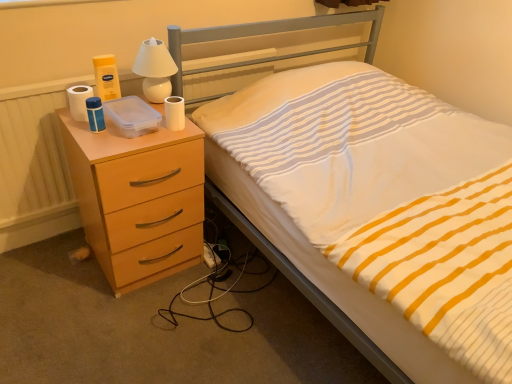
Question: Is the position of white matte toilet paper at upper right, the 1th toilet paper from the right, less distant than that of white glossy lamp at upper center?

Choices:
 (A) no
 (B) yes

Answer: (B)

Question: Can you confirm if white matte toilet paper at upper right, the 1th toilet paper from the right, is taller than white glossy lamp at upper center?

Choices:
 (A) yes
 (B) no

Answer: (B)

Question: Is white matte toilet paper at upper right, which is counted as the 2th toilet paper, starting from the left, shorter than white glossy lamp at upper center?

Choices:
 (A) yes
 (B) no

Answer: (A)

Question: From the image's perspective, is white matte toilet paper at upper right, which is counted as the 2th toilet paper, starting from the left, above white glossy lamp at upper center?

Choices:
 (A) no
 (B) yes

Answer: (A)

Question: Is white matte toilet paper at upper right, which is counted as the 2th toilet paper, starting from the left, bigger than white glossy lamp at upper center?

Choices:
 (A) yes
 (B) no

Answer: (B)

Question: In terms of width, does peach wood chest of drawers at left look wider or thinner when compared to white matte toilet paper at upper right, the 1th toilet paper from the right?

Choices:
 (A) thin
 (B) wide

Answer: (B)

Question: From a real-world perspective, is peach wood chest of drawers at left positioned above or below white matte toilet paper at upper right, the 1th toilet paper from the right?

Choices:
 (A) above
 (B) below

Answer: (B)

Question: Considering the positions of point (94, 180) and point (180, 125), is point (94, 180) closer or farther from the camera than point (180, 125)?

Choices:
 (A) farther
 (B) closer

Answer: (B)

Question: Would you say peach wood chest of drawers at left is inside or outside white matte toilet paper at upper right, the 1th toilet paper from the right?

Choices:
 (A) outside
 (B) inside

Answer: (A)

Question: From the image's perspective, is white glossy lamp at upper center positioned above or below white matte toilet paper at upper right, the 1th toilet paper from the right?

Choices:
 (A) above
 (B) below

Answer: (A)

Question: Is point (153, 82) positioned closer to the camera than point (166, 122)?

Choices:
 (A) closer
 (B) farther

Answer: (B)

Question: Relative to white matte toilet paper at upper right, the 1th toilet paper from the right, is white glossy lamp at upper center in front or behind?

Choices:
 (A) behind
 (B) front

Answer: (A)

Question: Is white glossy lamp at upper center bigger or smaller than white matte toilet paper at upper right, the 1th toilet paper from the right?

Choices:
 (A) big
 (B) small

Answer: (A)

Question: Visually, is white matte toilet paper at upper right, which is counted as the 2th toilet paper, starting from the left, positioned to the left or to the right of white striped fabric at center?

Choices:
 (A) left
 (B) right

Answer: (A)

Question: Considering the positions of white matte toilet paper at upper right, which is counted as the 2th toilet paper, starting from the left, and white striped fabric at center in the image, is white matte toilet paper at upper right, which is counted as the 2th toilet paper, starting from the left, bigger or smaller than white striped fabric at center?

Choices:
 (A) small
 (B) big

Answer: (A)